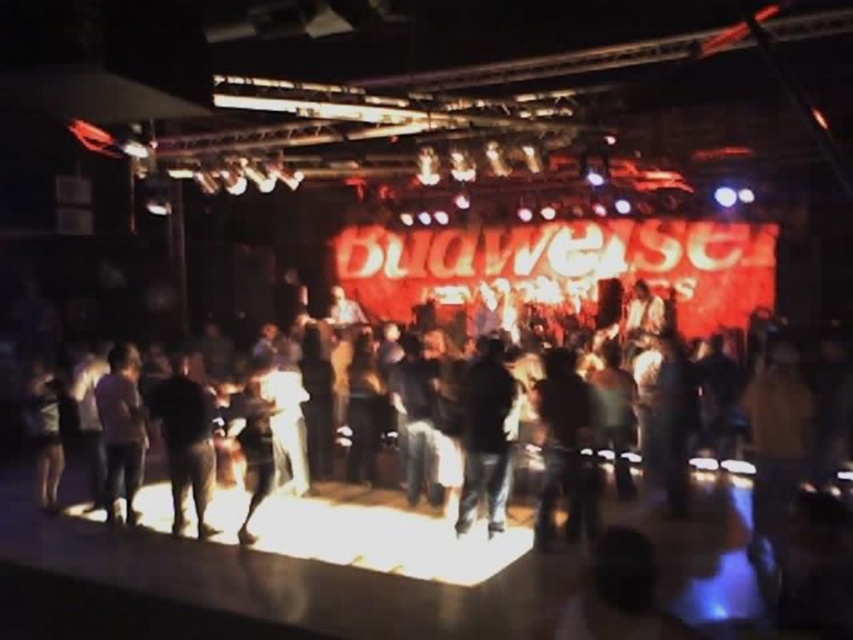
Question: Which point is farther from the camera taking this photo?

Choices:
 (A) (114, 426)
 (B) (404, 483)
 (C) (509, 433)

Answer: (B)

Question: Does dark fabric pants at lower left appear over dark gray fabric at lower left?

Choices:
 (A) yes
 (B) no

Answer: (B)

Question: Is dark fabric pants at lower left to the right of dark gray jeans at center from the viewer's perspective?

Choices:
 (A) yes
 (B) no

Answer: (B)

Question: Which object is positioned closest to the dark gray fabric at lower left?

Choices:
 (A) dark gray shirt at lower left
 (B) dark blue jeans at center
 (C) dark fabric at center
 (D) dark gray jeans at center

Answer: (A)

Question: Estimate the real-world distances between objects in this image. Which object is closer to the dark gray shirt at lower left?

Choices:
 (A) dark gray jeans at center
 (B) dark fabric pants at lower left

Answer: (B)

Question: Does dark fabric at center appear under dark gray jeans at center?

Choices:
 (A) no
 (B) yes

Answer: (B)